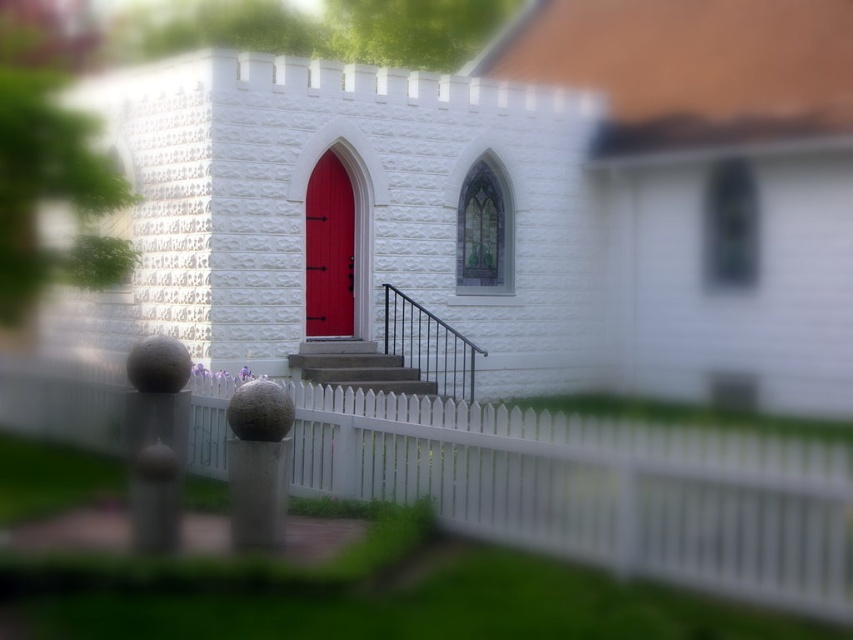
Who is positioned more to the right, white stone church at center or smooth concrete stairs at center?

white stone church at center

Is point (170, 232) closer to viewer compared to point (303, 355)?

No, it is not.

Is point (434, 280) farther from camera compared to point (337, 355)?

Yes, it is behind point (337, 355).

Locate an element on the screen. This screenshot has width=853, height=640. white stone church at center is located at coordinates (512, 204).

Can you confirm if white stone church at center is positioned to the left of white picket fence at center?

No, white stone church at center is not to the left of white picket fence at center.

Which is behind, point (598, 371) or point (486, 493)?

The point (598, 371) is more distant.

The height and width of the screenshot is (640, 853). Identify the location of white stone church at center. 512,204.

Is white picket fence at center smaller than smooth concrete stairs at center?

Actually, white picket fence at center might be larger than smooth concrete stairs at center.

Can you confirm if white picket fence at center is taller than smooth concrete stairs at center?

Indeed, white picket fence at center has a greater height compared to smooth concrete stairs at center.

Is point (701, 580) positioned in front of point (412, 374)?

That is True.

I want to click on white picket fence at center, so click(599, 490).